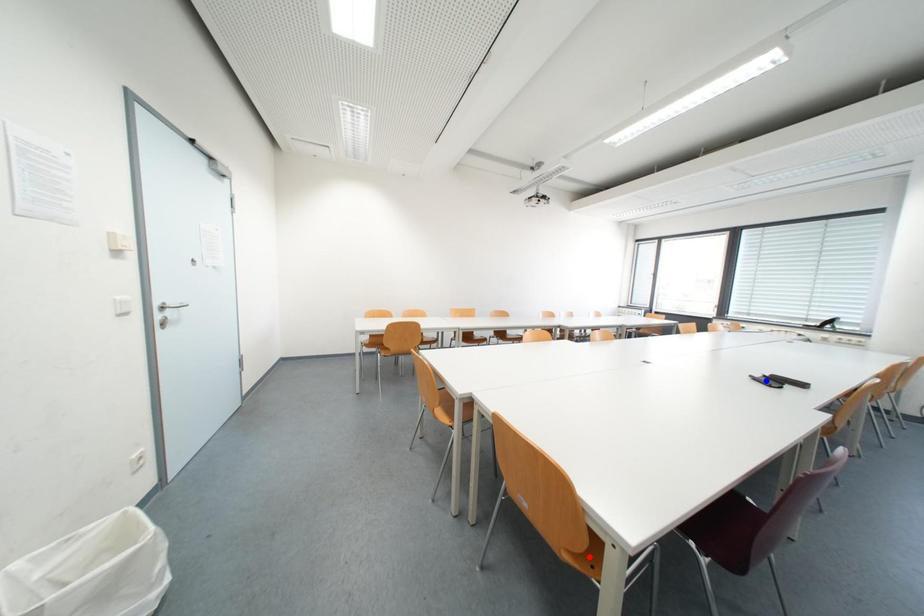
Question: Which of the two points in the image is closer to the camera?

Choices:
 (A) Blue point is closer.
 (B) Red point is closer.

Answer: (B)